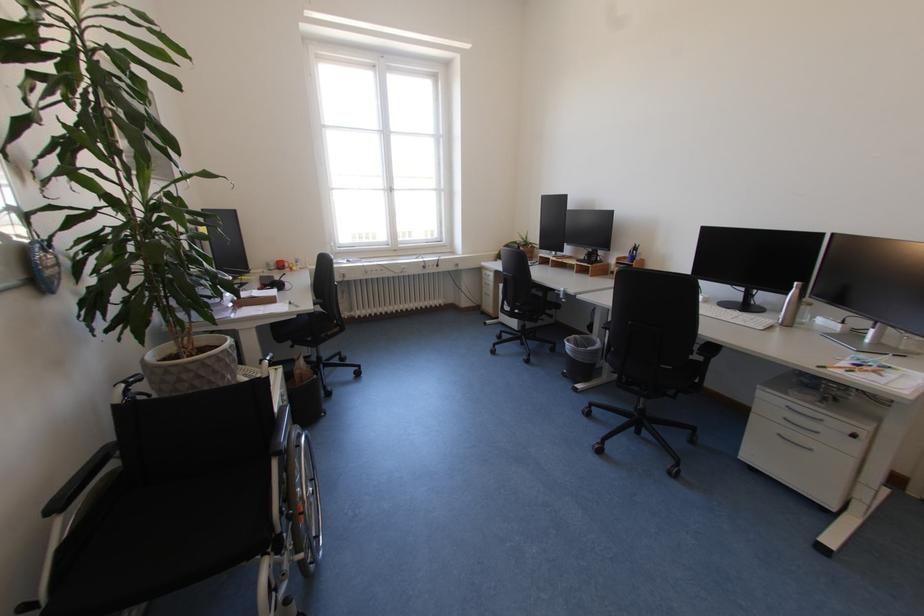
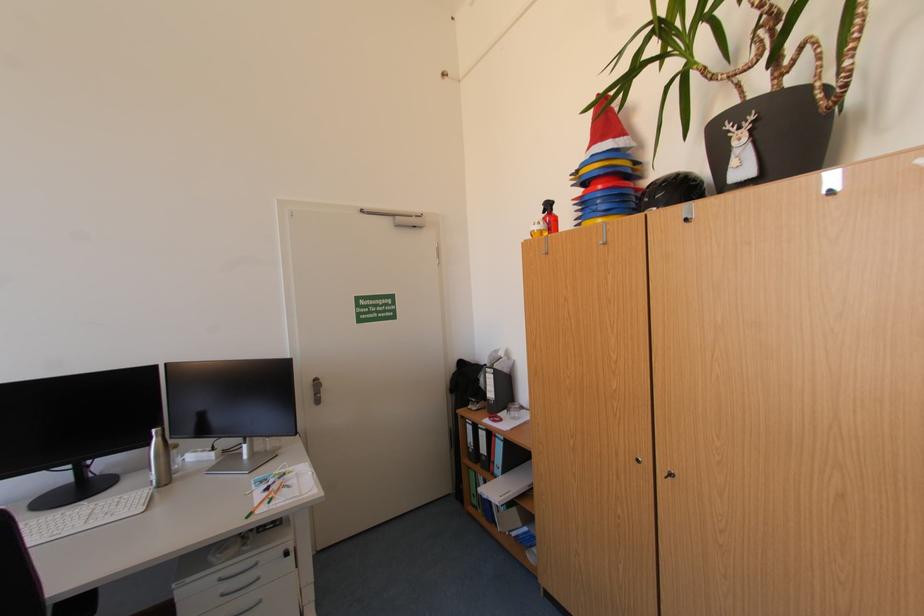
Question: The camera is either moving clockwise (left) or counter-clockwise (right) around the object. The first image is from the beginning of the video and the second image is from the end. Is the camera moving left or right when shooting the video?

Choices:
 (A) Left
 (B) Right

Answer: (A)